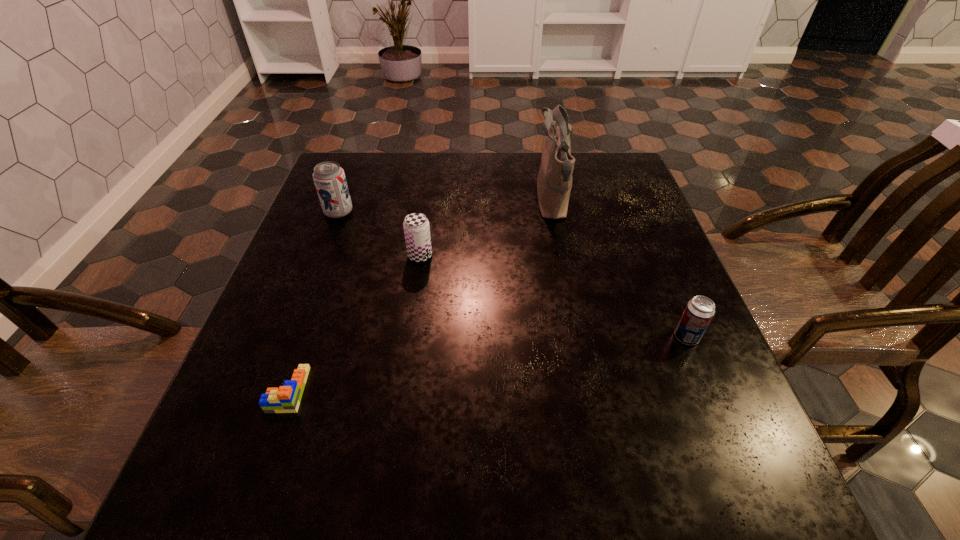
Locate an element on the screen. free region located 0.060m on the front-facing side of the tallest object is located at coordinates (511, 201).

Find the location of a particular element. This screenshot has height=540, width=960. vacant area situated 0.300m on the front-facing side of the tallest object is located at coordinates (419, 201).

You are a GUI agent. You are given a task and a screenshot of the screen. Output one action in this format:
    pyautogui.click(x=<x>, y=<y>)
    Task: Click on the vacant space located on the front-facing side of the tallest object
    The image size is (960, 540).
    Given the screenshot: What is the action you would take?
    pyautogui.click(x=438, y=201)

In order to click on vacant space situated 0.310m on the right of the tallest beer can in this screenshot , I will do `click(475, 212)`.

This screenshot has width=960, height=540. In order to click on free space located 0.170m on the back of the second nearest beer can in this screenshot , I will do `click(427, 205)`.

Locate an element on the screen. The image size is (960, 540). free location located 0.070m on the front of the rightmost object is located at coordinates (704, 380).

Where is `vacant region located on the back of the Lego`? vacant region located on the back of the Lego is located at coordinates (314, 316).

In order to click on object located in the far edge section of the desktop in this screenshot , I will do tap(554, 182).

Locate an element on the screen. Image resolution: width=960 pixels, height=540 pixels. beer can located at the left edge is located at coordinates (329, 178).

Image resolution: width=960 pixels, height=540 pixels. I want to click on Lego located in the left edge section of the desktop, so click(x=286, y=399).